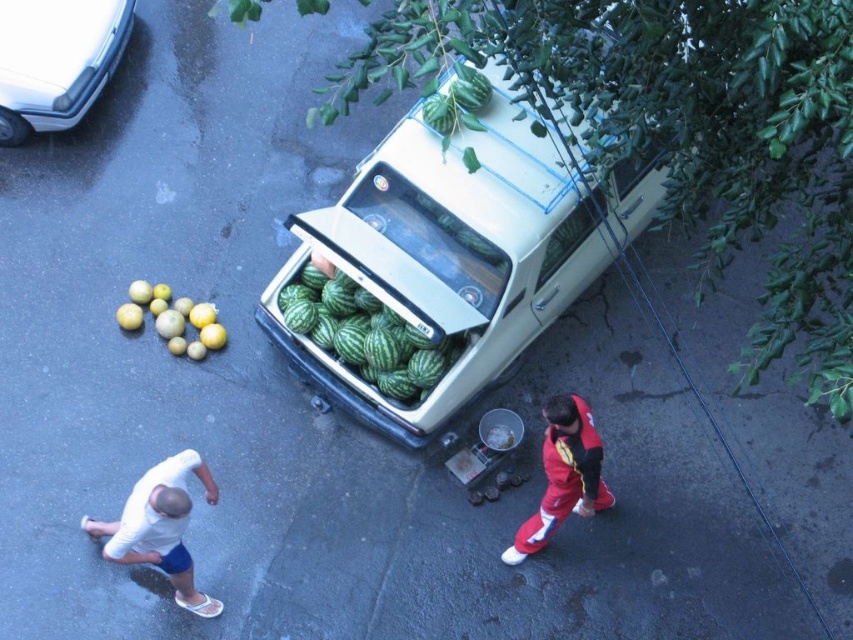
You are a delivery driver who needs to park your car next to the white fabric shorts at lower left. Based on the scene, can your car fit in the available space if the car is as wide as the white glossy car at upper left?

The white glossy car at upper left is wider than the white fabric shorts at lower left, so if your car is as wide as the white glossy car at upper left, it might not fit in the space next to the white fabric shorts at lower left due to the limited width available.

You are a delivery person who needs to load a box onto the white glossy car at upper left. The box is as tall as the yellow matte citrus at left. Will the box fit inside the car without needing to be adjusted?

The white glossy car at upper left is taller than the yellow matte citrus at left. Since the box is as tall as the citrus, it will fit inside the car without needing adjustment.

You are a delivery person who needs to place a large package between the white glossy car at upper left and the yellow matte citrus at left. Can you fit the package if it requires 7 feet of space?

The white glossy car at upper left and yellow matte citrus at left are 6.82 feet apart from each other, so the package requiring 7 feet of space cannot fit between them.